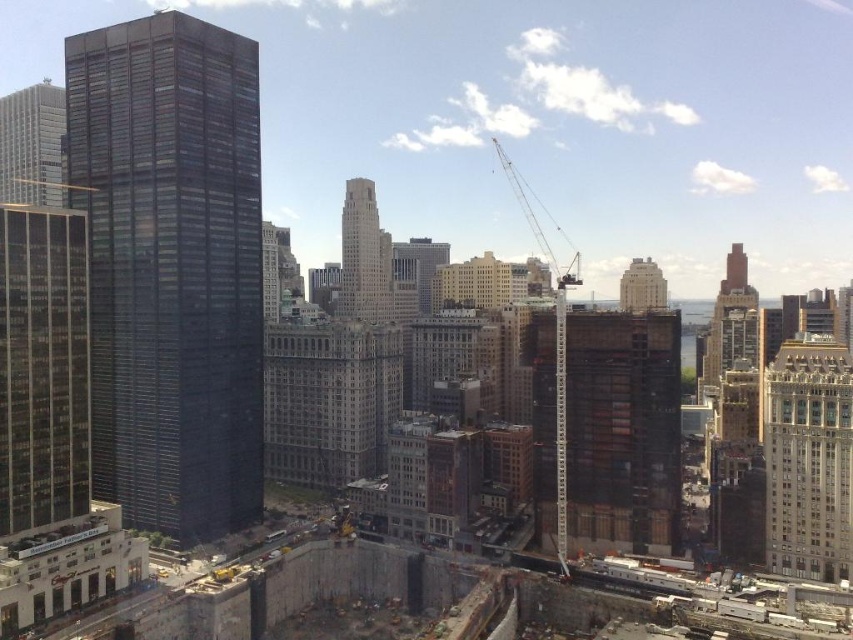
Question: Among these points, which one is farthest from the camera?

Choices:
 (A) (9, 93)
 (B) (836, 380)
 (C) (627, 296)
 (D) (556, 296)

Answer: (A)

Question: Among these points, which one is nearest to the camera?

Choices:
 (A) (16, 140)
 (B) (107, 148)
 (C) (347, 250)

Answer: (B)

Question: Can you confirm if dark brown wooden tower at center is positioned to the left of dark glass skyscraper at upper left?

Choices:
 (A) yes
 (B) no

Answer: (B)

Question: Is dark brown wooden tower at center thinner than dark gray concrete building at upper center?

Choices:
 (A) no
 (B) yes

Answer: (B)

Question: Which point is closer to the camera?

Choices:
 (A) (641, 419)
 (B) (776, 426)
 (C) (344, 300)
 (D) (35, 182)

Answer: (B)

Question: Is gold textured building at right further to camera compared to metallic gray crane at upper right?

Choices:
 (A) yes
 (B) no

Answer: (B)